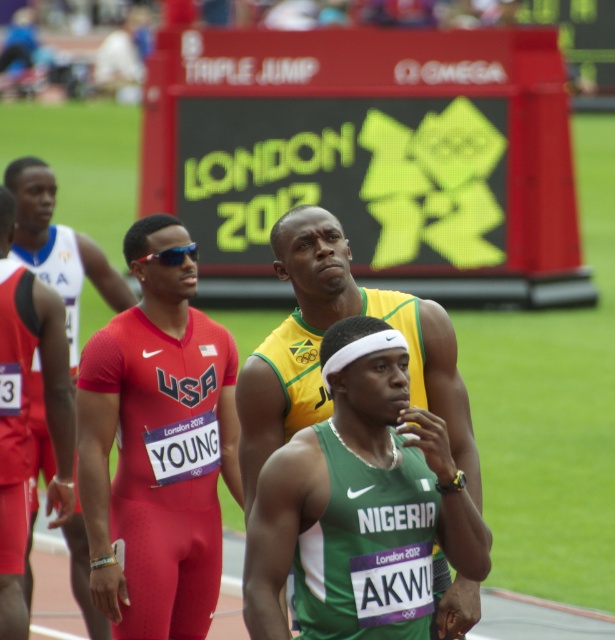
Does matte red uniform at center appear over green jersey at center?

Incorrect, matte red uniform at center is not positioned above green jersey at center.

Does matte red uniform at center have a lesser height compared to green jersey at center?

In fact, matte red uniform at center may be taller than green jersey at center.

What do you see at coordinates (157, 448) in the screenshot?
I see `matte red uniform at center` at bounding box center [157, 448].

This screenshot has width=615, height=640. What are the coordinates of `matte red uniform at center` in the screenshot? It's located at (157, 448).

Who is positioned more to the left, red matte uniform at center or sunglasses at center?

red matte uniform at center

Which is behind, point (33, 188) or point (189, 256)?

The point (33, 188) is more distant.

Find the location of a particular element. The height and width of the screenshot is (640, 615). red matte uniform at center is located at coordinates (31, 202).

Between matte red uniform at center and sunglasses at center, which one appears on the left side from the viewer's perspective?

Positioned to the left is sunglasses at center.

Does matte red uniform at center appear on the right side of sunglasses at center?

Indeed, matte red uniform at center is positioned on the right side of sunglasses at center.

Where is `matte red uniform at center`? The width and height of the screenshot is (615, 640). matte red uniform at center is located at coordinates (157, 448).

Locate an element on the screen. matte red uniform at center is located at coordinates (157, 448).